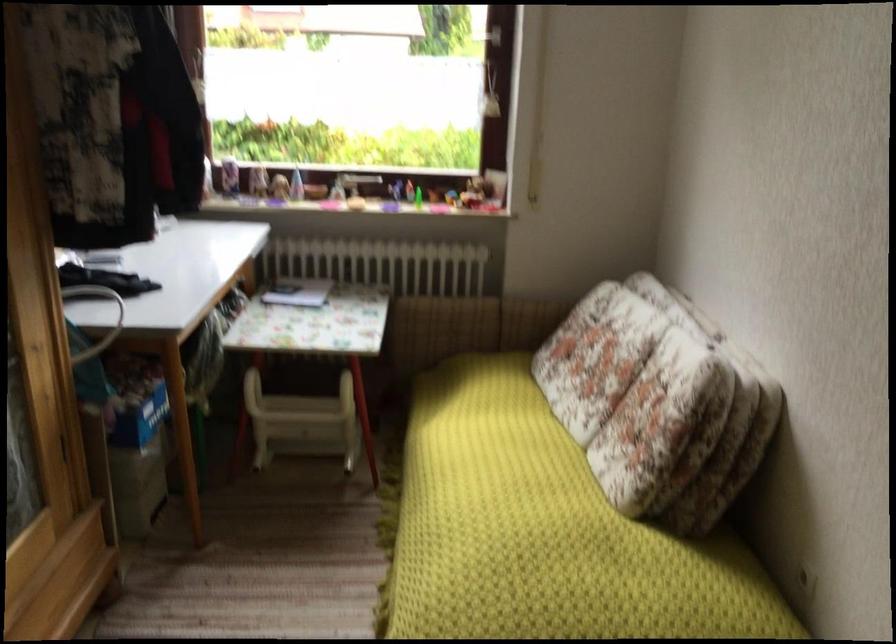
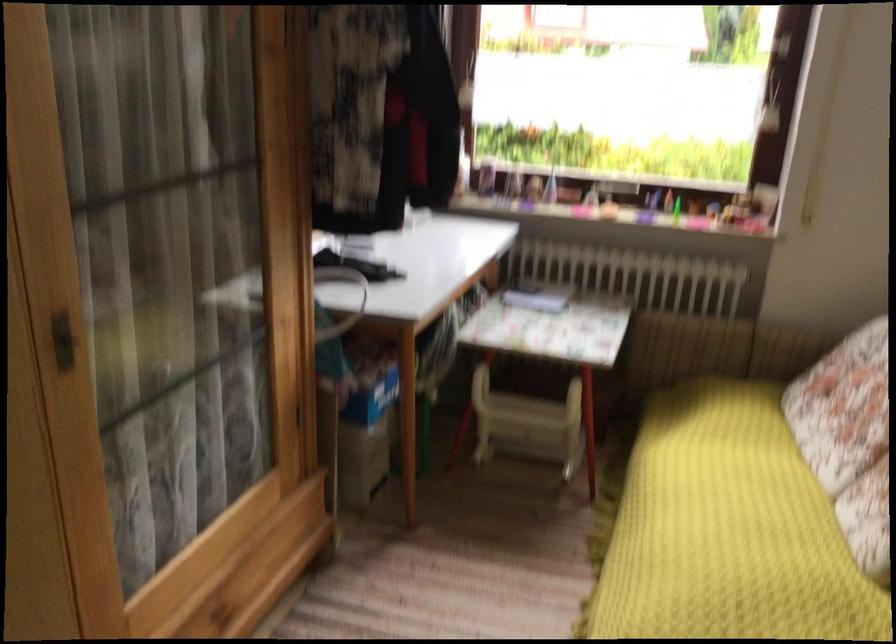
Question: Which direction would the cameraman need to move to produce the second image? Reply with the corresponding letter.

Choices:
 (A) Left
 (B) Right
 (C) Forward
 (D) Backward

Answer: (C)